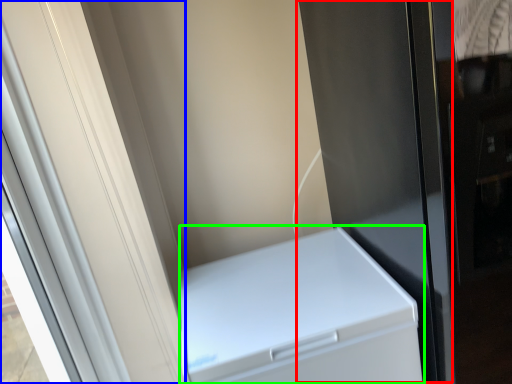
Question: Which is farther away from screen door (highlighted by a red box)? screen door (highlighted by a blue box) or home appliance (highlighted by a green box)?

Choices:
 (A) screen door
 (B) home appliance

Answer: (A)